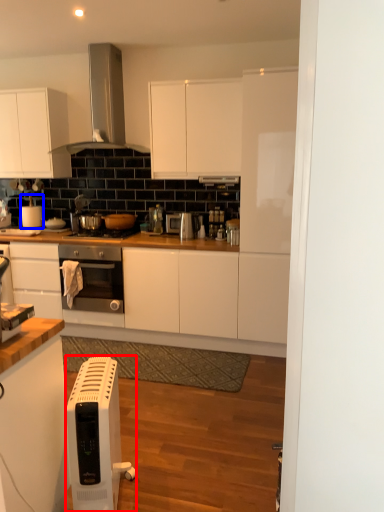
Question: Which point is closer to the camera, home appliance (highlighted by a red box) or appliance (highlighted by a blue box)?

Choices:
 (A) home appliance
 (B) appliance

Answer: (A)